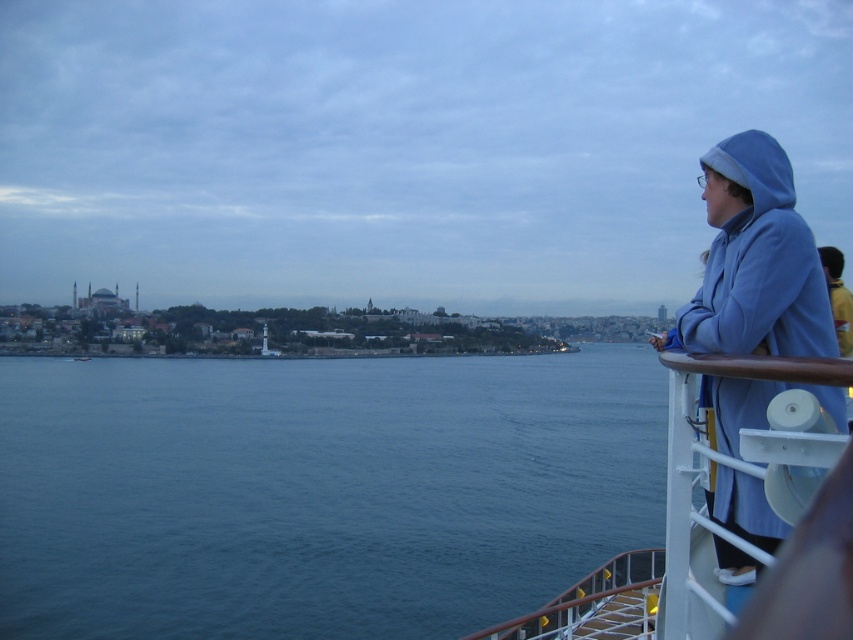
Between blue water at lower left and white plastic railing at right, which one appears on the right side from the viewer's perspective?

Positioned to the right is white plastic railing at right.

Does point (531, 356) lie behind point (705, 509)?

Yes, it is behind point (705, 509).

Which is behind, point (440, 428) or point (795, 364)?

The point (440, 428) is behind.

At what (x,y) coordinates should I click in order to perform the action: click on blue water at lower left. Please return your answer as a coordinate pair (x, y). The image size is (853, 640). Looking at the image, I should click on (318, 490).

Does point (814, 252) lie behind point (683, 440)?

Yes, point (814, 252) is behind point (683, 440).

Is blue fleece hoodie at right thinner than white plastic railing at right?

Yes.

Locate an element on the screen. The image size is (853, 640). blue fleece hoodie at right is located at coordinates (755, 260).

I want to click on blue fleece hoodie at right, so click(x=755, y=260).

Is blue water at lower left above blue fleece hoodie at right?

Actually, blue water at lower left is below blue fleece hoodie at right.

Is blue water at lower left positioned at the back of blue fleece hoodie at right?

Yes.

Is point (126, 394) positioned after point (738, 168)?

Yes, point (126, 394) is behind point (738, 168).

Identify the location of blue water at lower left. Image resolution: width=853 pixels, height=640 pixels. (318, 490).